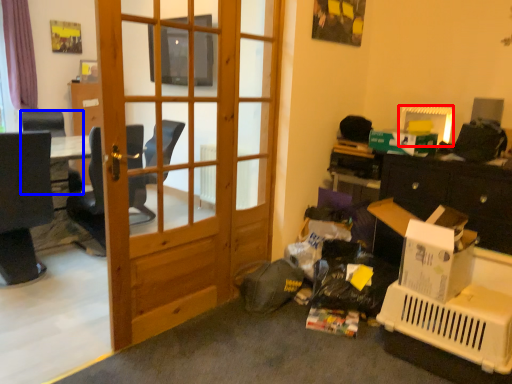
Question: Which object appears farthest to the camera in this image, picture frame (highlighted by a red box) or chair (highlighted by a blue box)?

Choices:
 (A) picture frame
 (B) chair

Answer: (B)